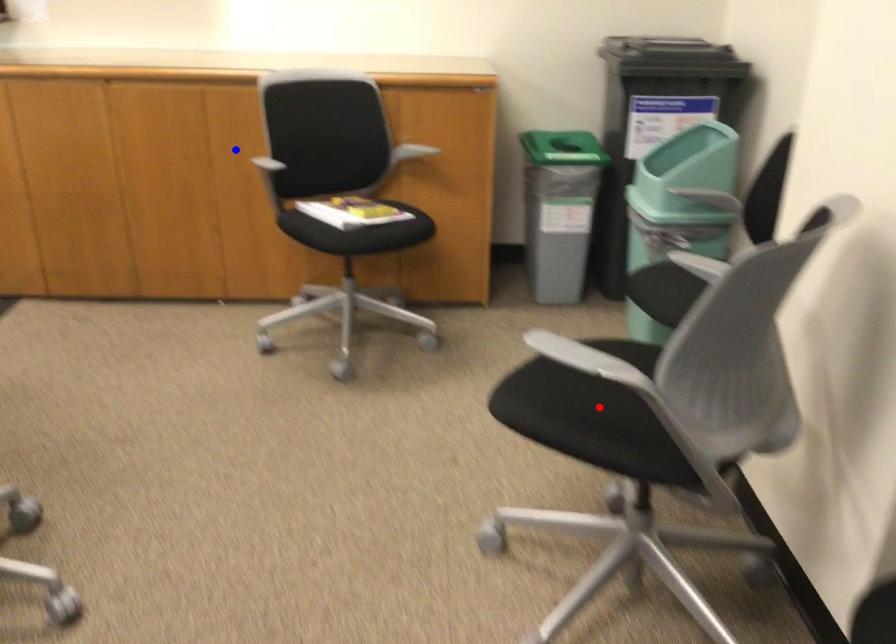
Question: Two points are marked on the image. Which point is closer to the camera?

Choices:
 (A) Blue point is closer.
 (B) Red point is closer.

Answer: (B)